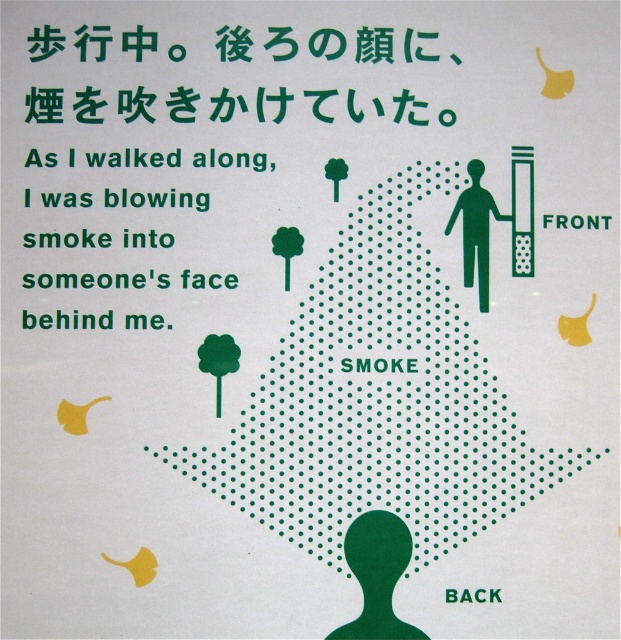
Between green dotted text at upper center and green silhouette figure at right, which one appears on the left side from the viewer's perspective?

green dotted text at upper center

Can you confirm if green dotted text at upper center is thinner than green silhouette figure at right?

No.

Does point (206, 116) come in front of point (469, 216)?

Yes.

I want to click on green dotted text at upper center, so click(268, 115).